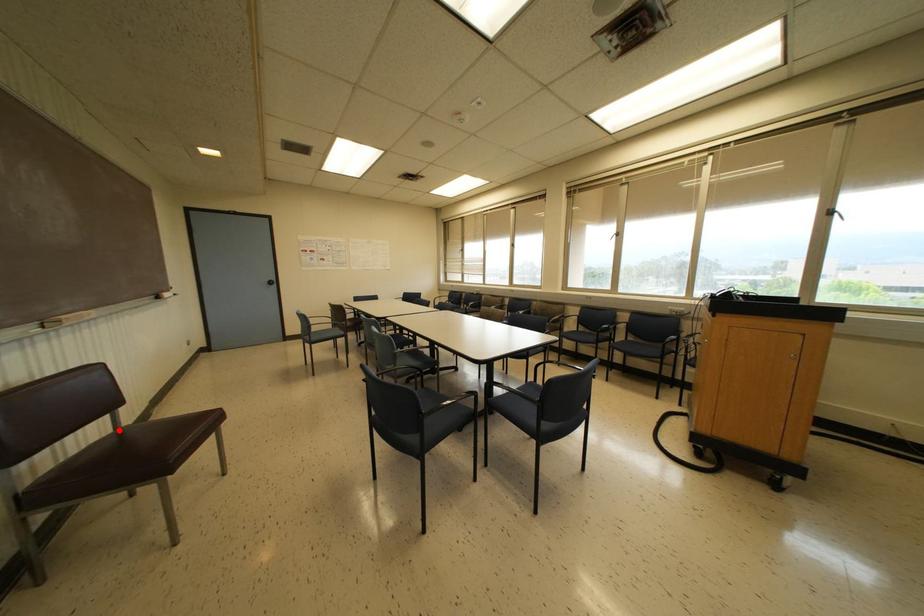
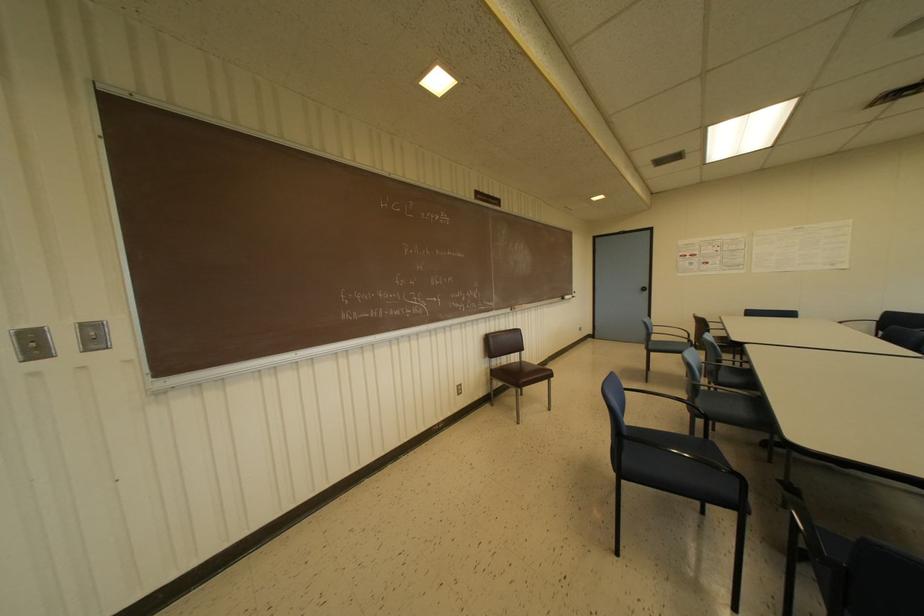
The point at the highlighted location is marked in the first image. Where is the corresponding point in the second image?

(519, 362)